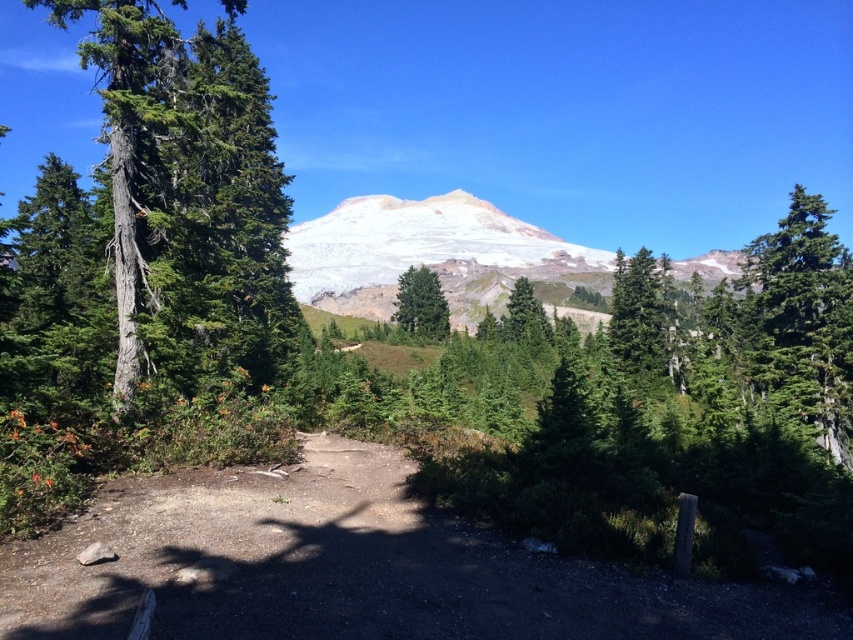
Question: Estimate the real-world distances between objects in this image. Which object is closer to the green matte tree at center?

Choices:
 (A) green matte tree at upper center
 (B) brown dirt track at center

Answer: (A)

Question: Can you confirm if white snow-covered mountain at center is bigger than green matte tree at center?

Choices:
 (A) yes
 (B) no

Answer: (A)

Question: Can you confirm if brown dirt track at center is positioned to the left of white snow-covered mountain at center?

Choices:
 (A) no
 (B) yes

Answer: (B)

Question: Estimate the real-world distances between objects in this image. Which object is farther from the gray bark tree at left?

Choices:
 (A) white snow-covered mountain at center
 (B) brown dirt track at center
 (C) green matte tree at upper center

Answer: (A)

Question: Among these objects, which one is nearest to the camera?

Choices:
 (A) green matte tree at upper center
 (B) green matte tree at center
 (C) white snow-covered mountain at center
 (D) brown dirt track at center

Answer: (D)

Question: Does brown dirt track at center appear under green matte tree at center?

Choices:
 (A) no
 (B) yes

Answer: (B)